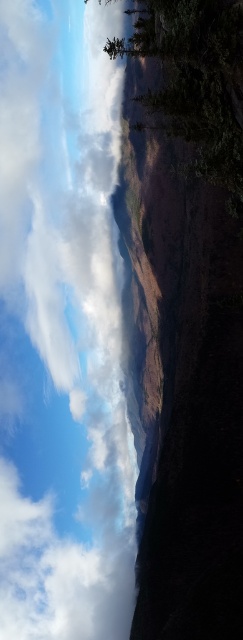
You are an airplane passenger looking out the window and see the white fluffy cloud at upper left and the green matte tree at upper center. Which object is closer to the airplane?

The white fluffy cloud at upper left is closer to the airplane because it is positioned further to the viewer than the green matte tree at upper center.

You are an astronomer analyzing the position of celestial objects in the image. Given that the white fluffy cloud at upper left is at coordinates point 0.516, 0.259, can you determine if it is positioned to the left or right of the center of the image?

The white fluffy cloud at upper left is located at point [62,330]. Since the x coordinate is 0.516, which is just over half of the image width, it is positioned to the right of the center of the image.

You are a photographer standing at the base of the mountain, aiming to capture the white fluffy cloud at upper left in your shot. The camera you are using has a maximum focus range of 700 feet. Will the cloud be in focus?

The white fluffy cloud at upper left is 709.13 feet from the camera, which exceeds the maximum focus range of 700 feet. Therefore, the cloud will not be in focus.